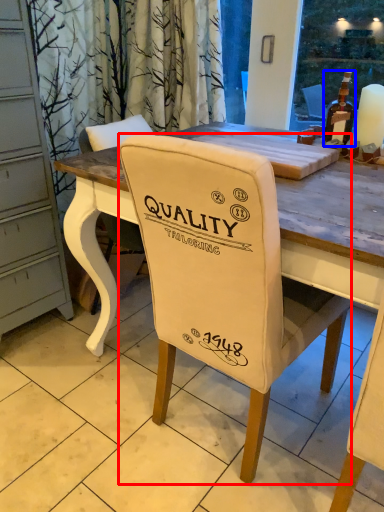
Question: Which point is further to the camera, chair (highlighted by a red box) or bottle (highlighted by a blue box)?

Choices:
 (A) chair
 (B) bottle

Answer: (B)